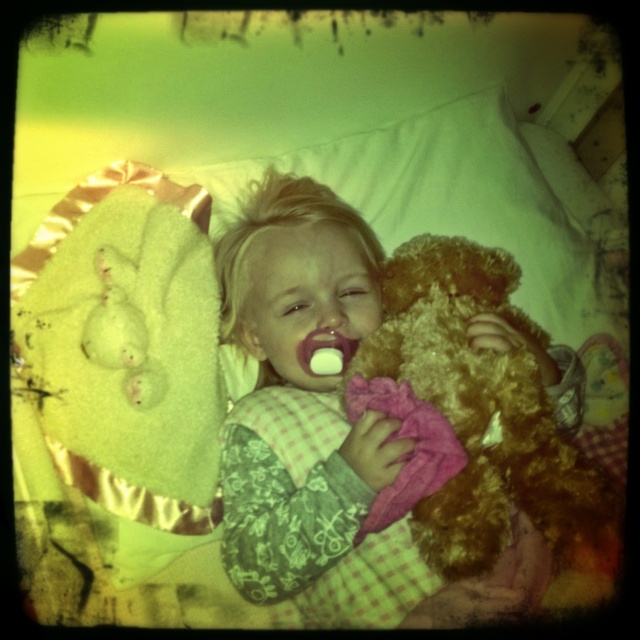
Question: Considering the real-world distances, which object is farthest from the white plush bear at upper left?

Choices:
 (A) fuzzy brown teddy bear at center
 (B) white matte pacifier at center

Answer: (A)

Question: Does fuzzy brown teddy bear at center have a smaller size compared to white plush bear at upper left?

Choices:
 (A) yes
 (B) no

Answer: (B)

Question: Which of the following is the farthest from the observer?

Choices:
 (A) [348, 397]
 (B) [310, 467]

Answer: (B)

Question: Does fluffy brown teddy bear at center have a lesser width compared to fuzzy brown teddy bear at center?

Choices:
 (A) no
 (B) yes

Answer: (A)

Question: In this image, where is fluffy brown teddy bear at center located relative to fuzzy brown teddy bear at center?

Choices:
 (A) right
 (B) left

Answer: (B)

Question: Which object is the farthest from the white plush bear at upper left?

Choices:
 (A) fuzzy brown teddy bear at center
 (B) fluffy brown teddy bear at center
 (C) white matte pacifier at center

Answer: (A)